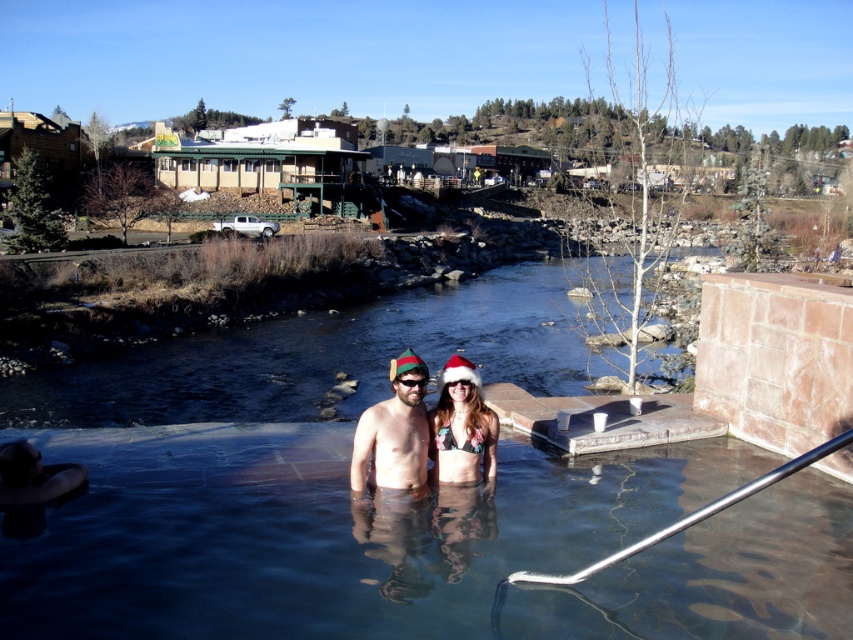
You are standing at the edge of the hot spring and want to walk towards the two points marked in the pool. Which point, point (426, 417) or point (422, 381), will you reach first?

Point (426, 417) is closer to the viewer, so you will reach it first.

You are designing a postcard featuring the clear water at center and the shiny metallic hat at center. Which object should you magnify to emphasize the main subject of the scene without distorting the composition?

The clear water at center should be magnified since its width is larger than the shiny metallic hat at center, making it the dominant element in the scene.

You are standing at the edge of the hot spring and want to place a floating flower at the point closer to you between point (477, 307) and point (355, 442). Which point should you choose?

Point (477, 307) is further to the viewer than point (355, 442), so you should choose point (477, 307) as it is closer to you.